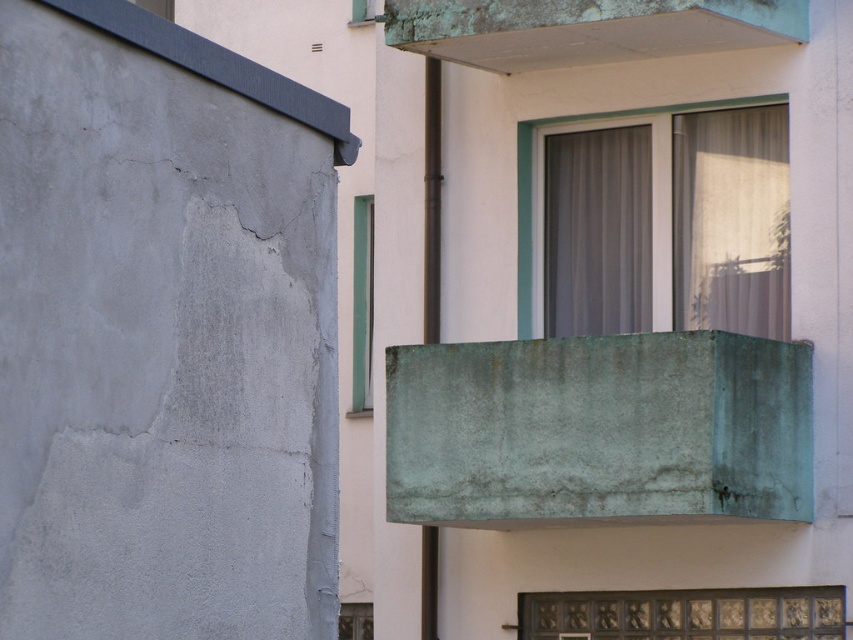
Is the position of smooth concrete ledge at upper left less distant than that of green glass door at center?

Yes, it is in front of green glass door at center.

Can you confirm if smooth concrete ledge at upper left is positioned to the left of green glass door at center?

In fact, smooth concrete ledge at upper left is to the right of green glass door at center.

Between point (242, 58) and point (363, 403), which one is positioned behind?

The point (363, 403) is behind.

Identify the location of smooth concrete ledge at upper left. click(x=218, y=67).

Who is more forward, (730, 362) or (732, 154)?

Point (730, 362)

Between point (648, 416) and point (766, 252), which one is positioned behind?

Point (766, 252)

I want to click on green patina concrete balcony at upper center, so click(598, 429).

In the scene shown: Does carved wood panel at lower center have a greater height compared to translucent glass window at upper center?

In fact, carved wood panel at lower center may be shorter than translucent glass window at upper center.

Does carved wood panel at lower center have a lesser width compared to translucent glass window at upper center?

Incorrect, carved wood panel at lower center's width is not less than translucent glass window at upper center's.

Is point (764, 636) positioned after point (578, 122)?

That is False.

At what (x,y) coordinates should I click in order to perform the action: click on carved wood panel at lower center. Please return your answer as a coordinate pair (x, y). Looking at the image, I should click on coord(685,612).